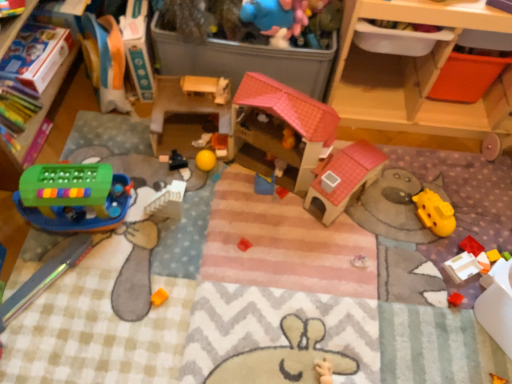
Where is `free location in front of metallic blue car at center, which is the 2th toy from left to right`? Image resolution: width=512 pixels, height=384 pixels. free location in front of metallic blue car at center, which is the 2th toy from left to right is located at coordinates 157,196.